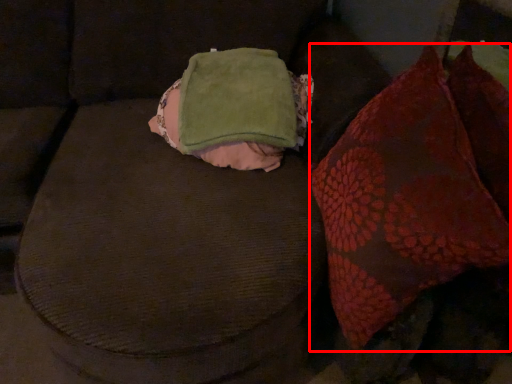
Question: From the image, what is the correct spatial relationship of throw pillow (annotated by the red box) in relation to bean bag chair?

Choices:
 (A) left
 (B) right

Answer: (B)